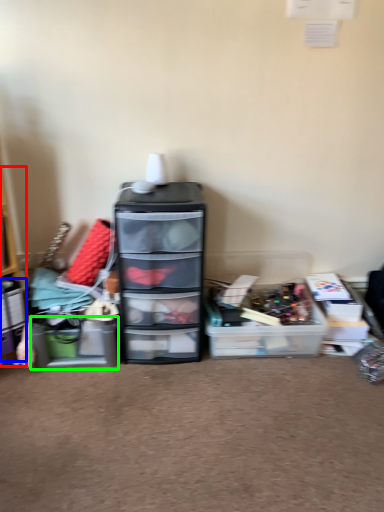
Question: Which object is the farthest from shelf (highlighted by a red box)? Choose among these: storage box (highlighted by a blue box) or storage box (highlighted by a green box).

Choices:
 (A) storage box
 (B) storage box

Answer: (B)